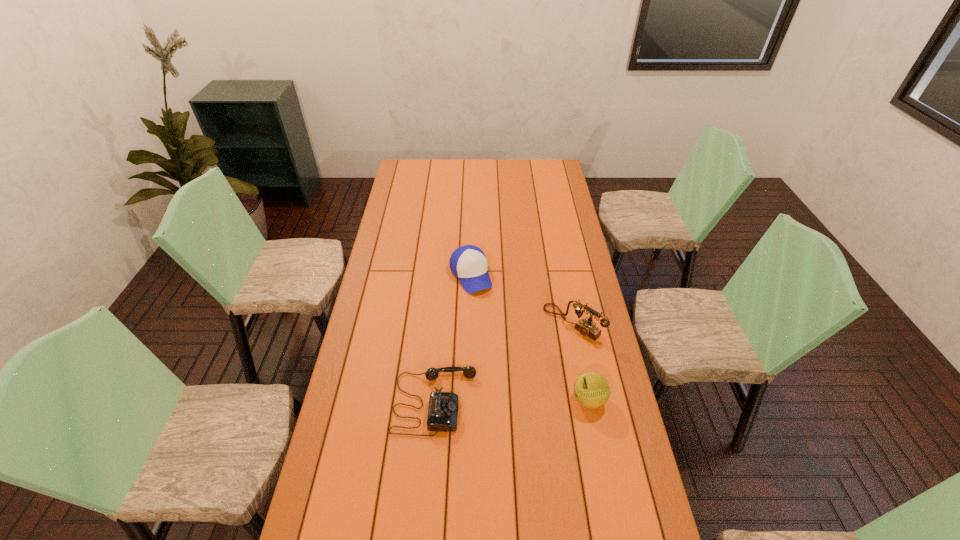
Locate an element on the screen. free space between the nearer telephone and the baseball cap is located at coordinates (453, 338).

I want to click on free spot between the farthest object and the third nearest object, so click(x=522, y=299).

Find the location of a particular element. free space between the third nearest object and the nearer telephone is located at coordinates (504, 362).

Identify the location of vacant region between the second farthest object and the softball. The image size is (960, 540). (581, 361).

Locate which object is the closest to the softball. Please provide its 2D coordinates. Your answer should be formatted as a tuple, i.e. [(x, y)], where the tuple contains the x and y coordinates of a point satisfying the conditions above.

[(586, 327)]

In order to click on object identified as the second closest to the left telephone in this screenshot , I will do `click(591, 389)`.

The image size is (960, 540). I want to click on blank area in the image that satisfies the following two spatial constraints: 1. on the front side of the farther telephone; 2. on the logo side of the softball, so click(x=588, y=400).